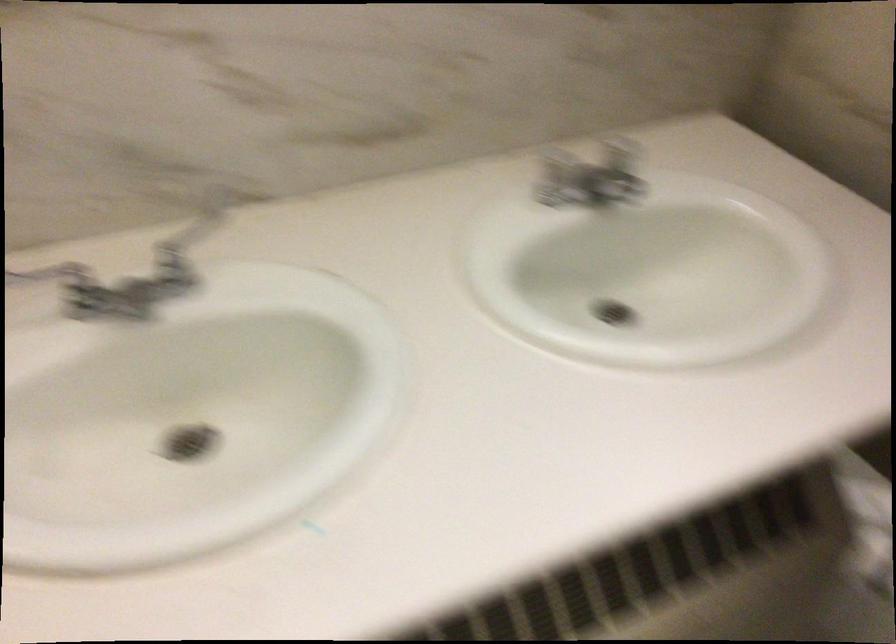
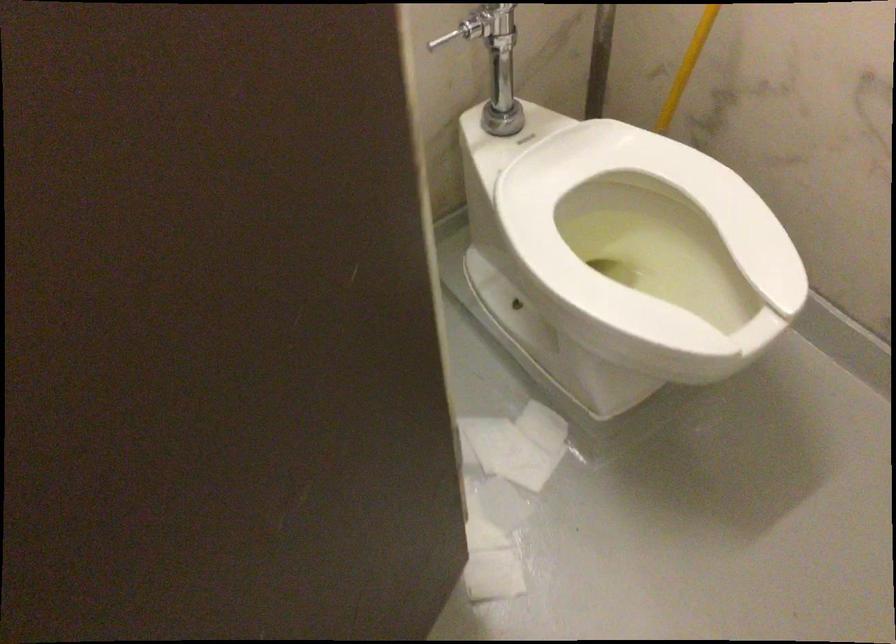
The images are taken continuously from a first-person perspective. In which direction are you moving?

The cameraman moved toward right, forward.